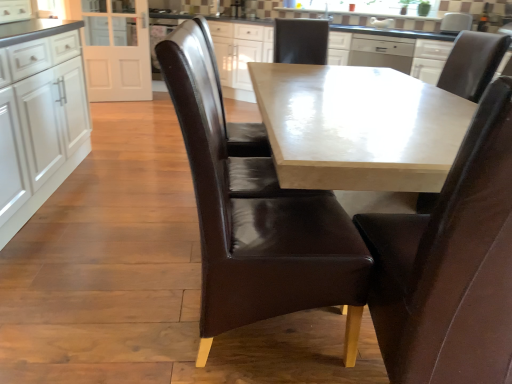
Question: Is brown leather chair at center, positioned as the 2th chair in right-to-left order, surrounding brown leather chair at upper right, which is the 1th chair in right-to-left order?

Choices:
 (A) yes
 (B) no

Answer: (B)

Question: Is the position of brown leather chair at center, positioned as the 2th chair in right-to-left order, less distant than that of brown leather chair at upper right, the fourth chair viewed from the left?

Choices:
 (A) no
 (B) yes

Answer: (B)

Question: Is brown leather chair at center, marked as the third chair in a left-to-right arrangement, at the right side of brown leather chair at upper right, the fourth chair viewed from the left?

Choices:
 (A) yes
 (B) no

Answer: (B)

Question: From a real-world perspective, is brown leather chair at center, positioned as the 2th chair in right-to-left order, positioned over brown leather chair at upper right, which is the 1th chair in right-to-left order, based on gravity?

Choices:
 (A) yes
 (B) no

Answer: (B)

Question: Does brown leather chair at center, marked as the third chair in a left-to-right arrangement, turn towards brown leather chair at upper right, the fourth chair viewed from the left?

Choices:
 (A) no
 (B) yes

Answer: (A)

Question: Is brown leather chair at center, positioned as the 2th chair in right-to-left order, further to camera compared to brown leather chair at upper right, which is the 1th chair in right-to-left order?

Choices:
 (A) no
 (B) yes

Answer: (A)

Question: Is satin silver dishwasher at upper center not close to brown leather chair at center, acting as the 3th chair starting from the right?

Choices:
 (A) no
 (B) yes

Answer: (B)

Question: From the image's perspective, is satin silver dishwasher at upper center below brown leather chair at center, positioned as the 2th chair in left-to-right order?

Choices:
 (A) yes
 (B) no

Answer: (B)

Question: From a real-world perspective, is satin silver dishwasher at upper center located beneath brown leather chair at center, positioned as the 2th chair in left-to-right order?

Choices:
 (A) no
 (B) yes

Answer: (A)

Question: Is satin silver dishwasher at upper center oriented away from brown leather chair at center, acting as the 3th chair starting from the right?

Choices:
 (A) yes
 (B) no

Answer: (B)

Question: Is satin silver dishwasher at upper center to the left of brown leather chair at center, positioned as the 2th chair in left-to-right order, from the viewer's perspective?

Choices:
 (A) no
 (B) yes

Answer: (A)

Question: Considering the relative positions of satin silver dishwasher at upper center and brown leather chair at center, positioned as the 2th chair in left-to-right order, in the image provided, is satin silver dishwasher at upper center in front of brown leather chair at center, positioned as the 2th chair in left-to-right order,?

Choices:
 (A) yes
 (B) no

Answer: (B)

Question: Could you tell me if brown leather chair at center, positioned as the 2th chair in left-to-right order, is facing brown leather chair at center, marked as the third chair in a left-to-right arrangement?

Choices:
 (A) no
 (B) yes

Answer: (B)